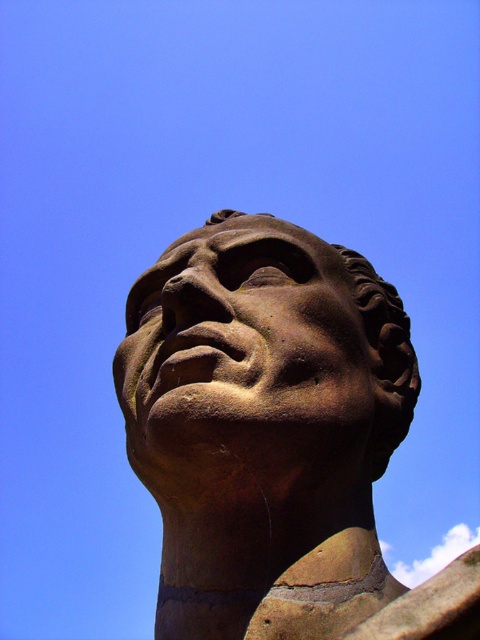
You are an art conservator examining the brown stone head at center and the brown stone face at center in the image. Which part of the sculpture is positioned lower?

The brown stone head at center is located below the brown stone face at center, so the brown stone head at center is positioned lower.

You are an archaeologist examining a sculpture. You need to document the exact position of the brown stone head at center. What are its coordinates?

The brown stone head at center is located at point (275, 436).

Consider the image. You are standing in front of a sculpted bust under a clear blue sky. There is a point at coordinates point (204, 365) on the sculpture. If you want to place a small plaque 1 meter in height at that point, will it be visible from where you are standing?

The point point (204, 365) is 52.67 meters from viewer. Since the plaque is only 1 meter tall, it would likely be too small to see clearly from such a distance of 52.67 meters. The small plaque at point (204, 365) would probably not be visible from where you are standing.